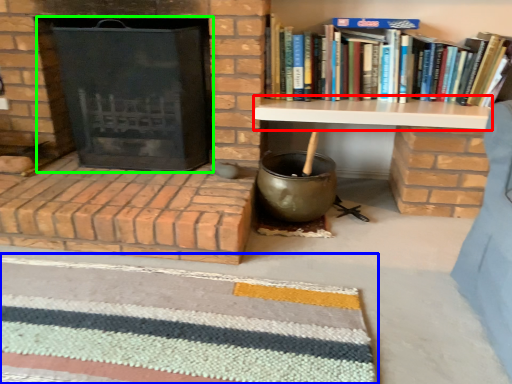
Question: Which object is the farthest from table (highlighted by a red box)? Choose among these: doormat (highlighted by a blue box) or fireplace (highlighted by a green box).

Choices:
 (A) doormat
 (B) fireplace

Answer: (A)